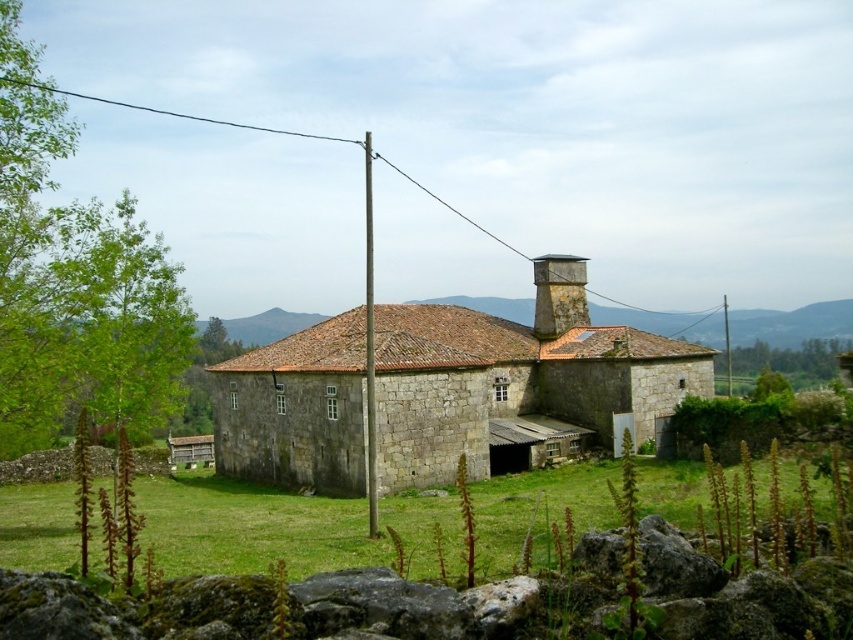
You are standing in front of the rustic stone building and notice the green grass at lower center and the stone chimney at upper center. Which object is located to the left of the other?

The green grass at lower center is positioned on the left side of stone chimney at upper center.

You are standing at the point marked as point (250,528) in the image. What is the immediate surface you are standing on?

The immediate surface you are standing on is green grass at lower center.

You are standing at the camera position looking at the rustic stone building. There is a point marked at coordinates point (x=308, y=516). Can you estimate how far this point is from your current position?

The point (x=308, y=516) is 30.73 meters away from the camera position.